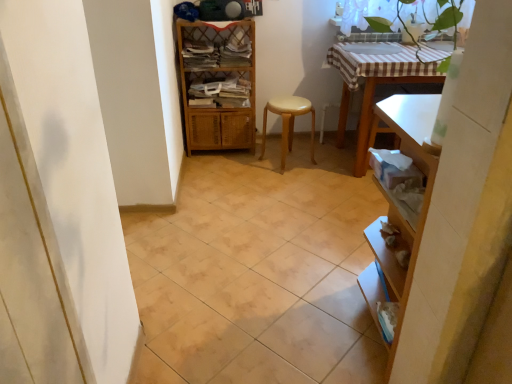
Where is `light brown wooden stool at center`? The width and height of the screenshot is (512, 384). light brown wooden stool at center is located at coordinates (288, 122).

Describe the element at coordinates (371, 48) in the screenshot. I see `white glossy sink at upper center` at that location.

The width and height of the screenshot is (512, 384). Identify the location of white glossy sink at upper center. (371, 48).

Describe the element at coordinates (258, 273) in the screenshot. The height and width of the screenshot is (384, 512). I see `beige ceramic tile at center` at that location.

You are a GUI agent. You are given a task and a screenshot of the screen. Output one action in this format:
    pyautogui.click(x=<x>, y=<y>)
    Task: Click on the light brown wooden stool at center
    Image resolution: width=512 pixels, height=384 pixels.
    Given the screenshot: What is the action you would take?
    pyautogui.click(x=288, y=122)

Which of these two, light brown wooden stool at center or white glossy sink at upper center, stands shorter?

Standing shorter between the two is white glossy sink at upper center.

Is point (313, 163) positioned behind point (372, 45)?

Yes, it is behind point (372, 45).

Is light brown wooden stool at center wider than white glossy sink at upper center?

In fact, light brown wooden stool at center might be narrower than white glossy sink at upper center.

Is light brown wooden stool at center positioned with its back to white glossy sink at upper center?

No, white glossy sink at upper center is not at the back of light brown wooden stool at center.

Is beige ceramic tile at center next to light brown wooden stool at center?

They are not placed beside each other.

From the image's perspective, is beige ceramic tile at center under light brown wooden stool at center?

Yes, from the image's perspective, beige ceramic tile at center is below light brown wooden stool at center.

Does point (293, 306) come behind point (287, 137)?

No, it is in front of (287, 137).

Image resolution: width=512 pixels, height=384 pixels. I want to click on step stool lying on the right of beige ceramic tile at center, so click(288, 122).

Based on their sizes in the image, would you say beige ceramic tile at center is bigger or smaller than white glossy sink at upper center?

In the image, beige ceramic tile at center appears to be larger than white glossy sink at upper center.

Is beige ceramic tile at center completely or partially outside of white glossy sink at upper center?

Absolutely, beige ceramic tile at center is external to white glossy sink at upper center.

Which is more to the left, beige ceramic tile at center or white glossy sink at upper center?

beige ceramic tile at center is more to the left.

Is beige ceramic tile at center directly adjacent to white glossy sink at upper center?

There is a gap between beige ceramic tile at center and white glossy sink at upper center.

Can you confirm if woven wood shelf at center is wider than light brown wooden stool at center?

Correct, the width of woven wood shelf at center exceeds that of light brown wooden stool at center.

Considering the positions of objects woven wood shelf at center and light brown wooden stool at center in the image provided, who is more to the left, woven wood shelf at center or light brown wooden stool at center?

woven wood shelf at center is more to the left.

From a real-world perspective, is woven wood shelf at center above or below light brown wooden stool at center?

woven wood shelf at center is above light brown wooden stool at center.

Is the surface of woven wood shelf at center in direct contact with light brown wooden stool at center?

There is a gap between woven wood shelf at center and light brown wooden stool at center.

How many degrees apart are the facing directions of woven wood shelf at center and beige ceramic tile at center?

91.3 degrees separate the facing orientations of woven wood shelf at center and beige ceramic tile at center.

Is point (188, 40) positioned after point (159, 334)?

Yes, point (188, 40) is behind point (159, 334).

Consider the image. Could you tell me if woven wood shelf at center is facing beige ceramic tile at center?

Yes, woven wood shelf at center is aimed at beige ceramic tile at center.

Between woven wood shelf at center and beige ceramic tile at center, which one has smaller width?

→ With smaller width is woven wood shelf at center.

Is light brown wooden stool at center inside or outside of woven wood shelf at center?

light brown wooden stool at center is not enclosed by woven wood shelf at center.

From the picture: From a real-world perspective, relative to woven wood shelf at center, is light brown wooden stool at center vertically above or below?

light brown wooden stool at center is below woven wood shelf at center.

In the scene shown: From a real-world perspective, is white glossy sink at upper center physically located above or below beige ceramic tile at center?

In terms of real-world spatial position, white glossy sink at upper center is above beige ceramic tile at center.

Does white glossy sink at upper center have a smaller size compared to beige ceramic tile at center?

Indeed, white glossy sink at upper center has a smaller size compared to beige ceramic tile at center.

Looking at this image, is white glossy sink at upper center looking in the opposite direction of beige ceramic tile at center?

No.

Locate an element on the screen. The image size is (512, 384). sink in front of the light brown wooden stool at center is located at coordinates (371, 48).

Where is `ceramic tile below the light brown wooden stool at center (from the image's perspective)`? Image resolution: width=512 pixels, height=384 pixels. ceramic tile below the light brown wooden stool at center (from the image's perspective) is located at coordinates (258, 273).

When comparing their distances from beige ceramic tile at center, does light brown wooden stool at center or white glossy sink at upper center seem further?

The object further to beige ceramic tile at center is white glossy sink at upper center.

Considering their positions, is woven wood shelf at center positioned further to beige ceramic tile at center than white glossy sink at upper center?

white glossy sink at upper center.

Considering their positions, is light brown wooden stool at center positioned further to woven wood shelf at center than beige ceramic tile at center?

beige ceramic tile at center is further to woven wood shelf at center.

Considering their positions, is beige ceramic tile at center positioned closer to light brown wooden stool at center than woven wood shelf at center?

woven wood shelf at center lies closer to light brown wooden stool at center than the other object.

Considering their positions, is beige ceramic tile at center positioned closer to woven wood shelf at center than light brown wooden stool at center?

The object closer to woven wood shelf at center is light brown wooden stool at center.

Considering their positions, is beige ceramic tile at center positioned further to white glossy sink at upper center than light brown wooden stool at center?

Among the two, beige ceramic tile at center is located further to white glossy sink at upper center.

From the image, which object appears to be farther from light brown wooden stool at center, woven wood shelf at center or white glossy sink at upper center?

white glossy sink at upper center is positioned further to the anchor light brown wooden stool at center.

Considering their positions, is white glossy sink at upper center positioned closer to light brown wooden stool at center than woven wood shelf at center?

woven wood shelf at center is positioned closer to the anchor light brown wooden stool at center.

At what (x,y) coordinates should I click in order to perform the action: click on step stool located between woven wood shelf at center and white glossy sink at upper center in the left-right direction. Please return your answer as a coordinate pair (x, y). Looking at the image, I should click on (288, 122).

Where is `sink located between beige ceramic tile at center and light brown wooden stool at center in the depth direction`? sink located between beige ceramic tile at center and light brown wooden stool at center in the depth direction is located at coordinates (371, 48).

I want to click on shelf located between beige ceramic tile at center and light brown wooden stool at center in the depth direction, so click(x=217, y=77).

Identify the location of sink between beige ceramic tile at center and woven wood shelf at center along the z-axis. (371, 48).